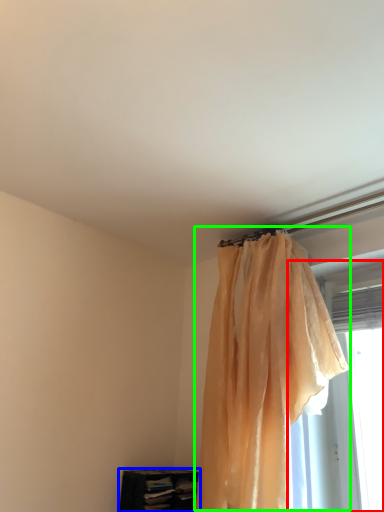
Question: Based on their relative distances, which object is nearer to window (highlighted by a red box)? Choose from furniture (highlighted by a blue box) and curtain (highlighted by a green box).

Choices:
 (A) furniture
 (B) curtain

Answer: (B)